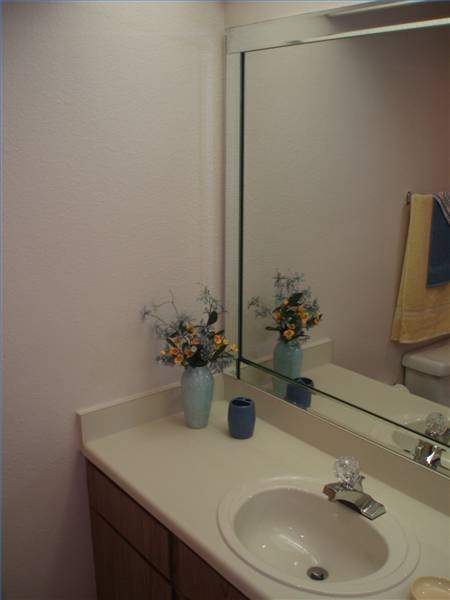
Image resolution: width=450 pixels, height=600 pixels. I want to click on bathroom countertop, so click(187, 479).